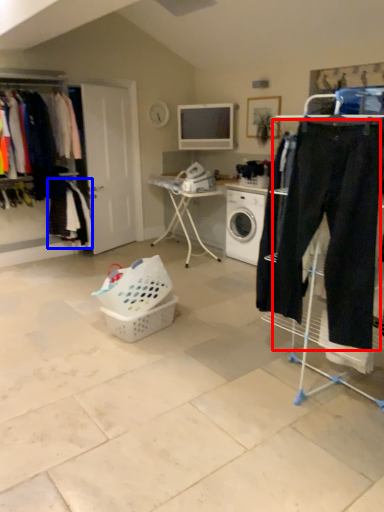
Question: Which point is further to the camera, sweat pant (highlighted by a red box) or clothing (highlighted by a blue box)?

Choices:
 (A) sweat pant
 (B) clothing

Answer: (B)